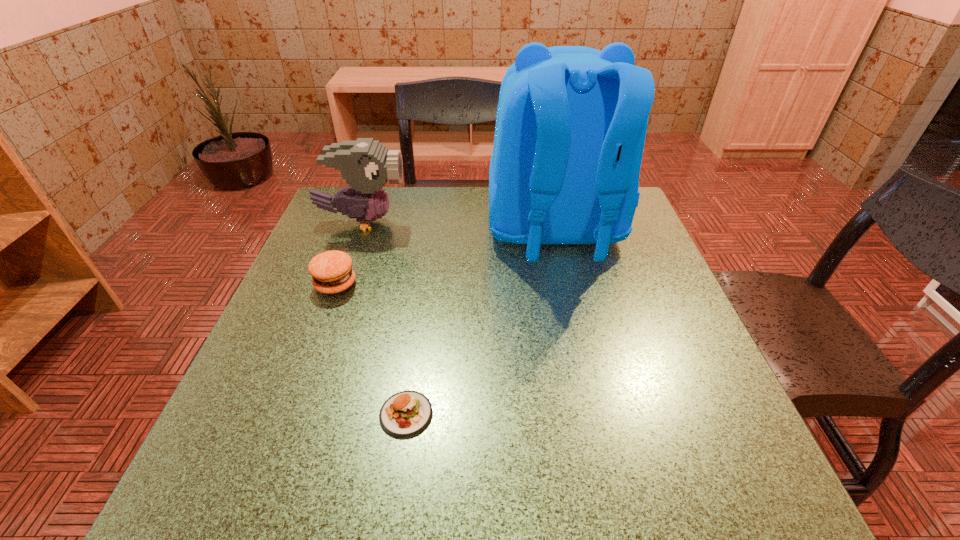
The width and height of the screenshot is (960, 540). What are the coordinates of `vacant area between the bird and the rightmost object` in the screenshot? It's located at (459, 227).

Identify the location of free space between the nearer patty (food) and the third shortest object. The image size is (960, 540). (385, 318).

Identify the location of vacant space in between the bird and the nearest object. This screenshot has height=540, width=960. (385, 318).

Identify the location of object that is the third closest one to the tallest object. click(x=405, y=414).

Locate an element on the screen. object that can be found as the second closest to the nearest object is located at coordinates (571, 122).

Where is `vacant space that satisfies the following two spatial constraints: 1. at the beak of the bird; 2. on the left side of the shorter patty (food)`? vacant space that satisfies the following two spatial constraints: 1. at the beak of the bird; 2. on the left side of the shorter patty (food) is located at coordinates (295, 414).

The image size is (960, 540). Find the location of `vacant area that satisfies the following two spatial constraints: 1. at the beak of the bird; 2. on the left side of the third object from left to right`. vacant area that satisfies the following two spatial constraints: 1. at the beak of the bird; 2. on the left side of the third object from left to right is located at coordinates (295, 414).

This screenshot has width=960, height=540. Identify the location of free point that satisfies the following two spatial constraints: 1. at the beak of the second tallest object; 2. on the right side of the shortest object. (295, 414).

Identify the location of vacant space that satisfies the following two spatial constraints: 1. at the beak of the bird; 2. on the front side of the left patty (food). The height and width of the screenshot is (540, 960). (341, 285).

I want to click on free spot that satisfies the following two spatial constraints: 1. at the beak of the bird; 2. on the front side of the left patty (food), so pyautogui.click(x=341, y=285).